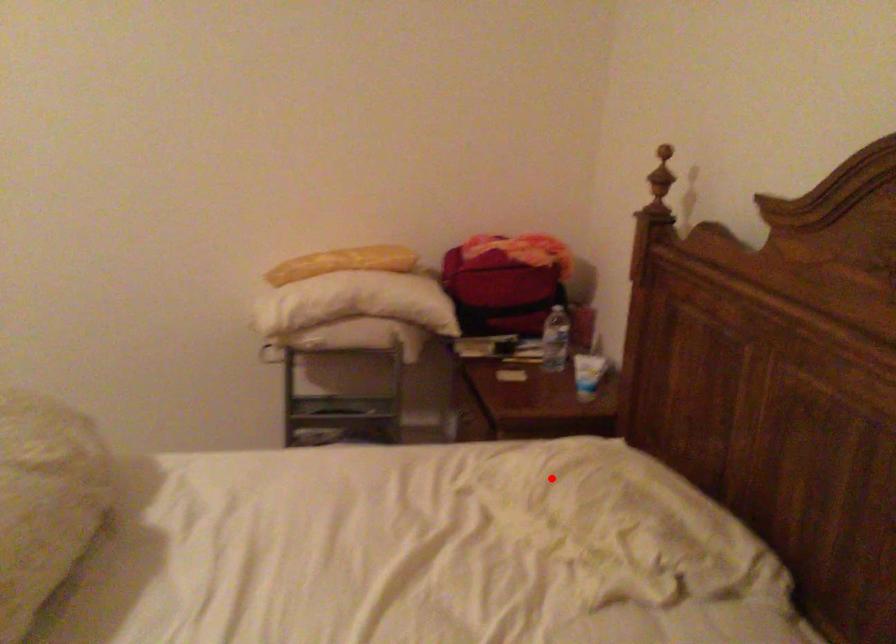
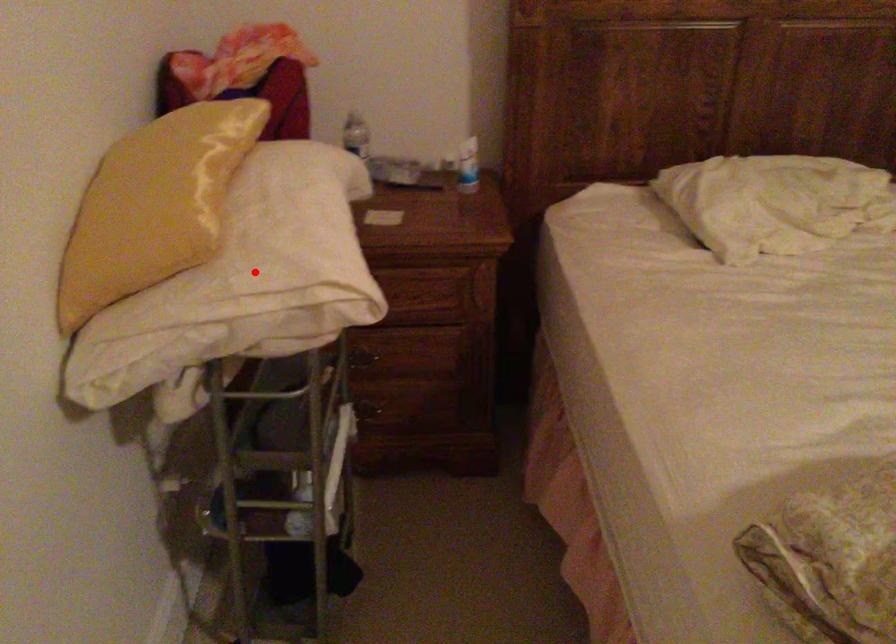
I am providing you with two images of the same scene from different viewpoints. A red point is marked on the first image and another point is marked on the second image. Does the point marked in image1 correspond to the same location as the one in image2?

No